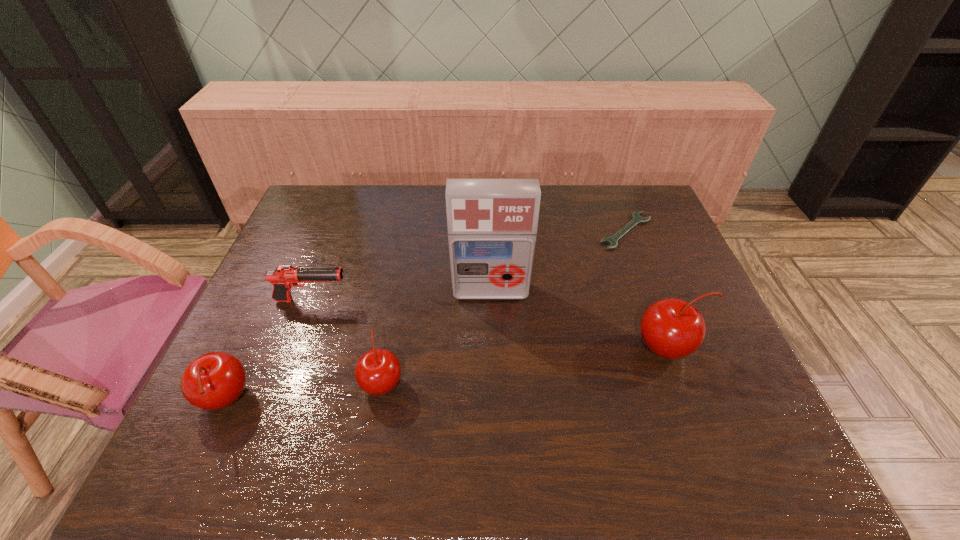
The image size is (960, 540). I want to click on wrench that is at the right edge, so click(x=636, y=218).

Identify the location of object positioned at the near left corner. (215, 380).

Locate an element on the screen. object that is at the far right corner is located at coordinates click(636, 218).

In the image, there is a desktop. Where is `vacant area at the far edge`? vacant area at the far edge is located at coordinates (581, 207).

This screenshot has width=960, height=540. In order to click on blank space at the left edge of the desktop in this screenshot , I will do `click(293, 253)`.

The width and height of the screenshot is (960, 540). Identify the location of free space at the right edge. (661, 227).

Where is `free space at the far right corner of the desktop`? The height and width of the screenshot is (540, 960). free space at the far right corner of the desktop is located at coordinates (639, 185).

Identify the location of free space between the third object from right to left and the second cherry from right to left. The image size is (960, 540). (437, 337).

What are the coordinates of `free space between the rightmost cherry and the tallest object` in the screenshot? It's located at (580, 320).

Where is `free space between the tallest object and the gun`? The width and height of the screenshot is (960, 540). free space between the tallest object and the gun is located at coordinates (401, 296).